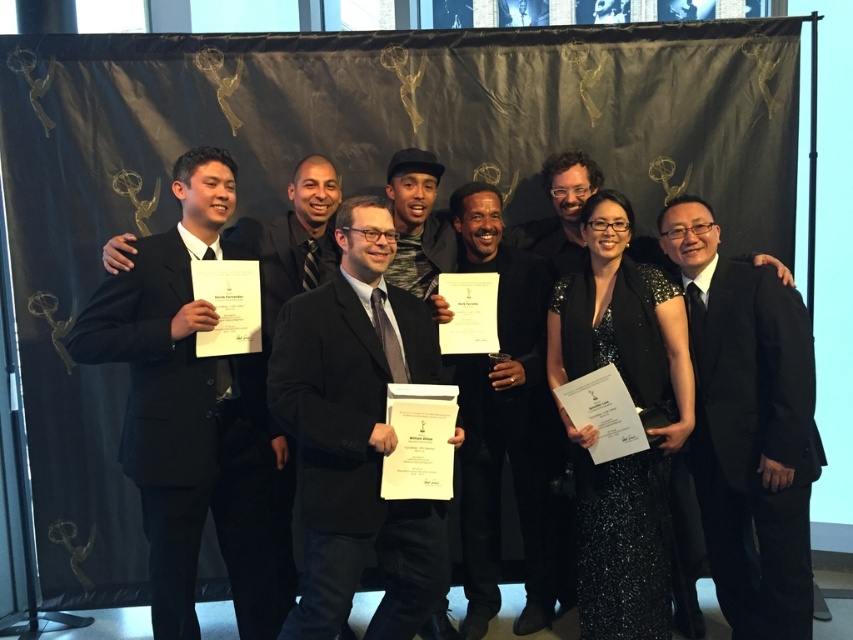
You are a photographer at the Emmy Awards event. You notice the black suit at left and the black satin suit at right in your frame. Which one is closer to the camera?

The black suit at left is closer to the camera because it is in front of the black satin suit at right.

You are a photographer at the Emmy Awards event. You need to arrange the participants so that the black suit at left and the black satin suit at right are placed symmetrically. Given their different widths, which one should be placed closer to the center to maintain symmetry?

The black suit at left is wider than the black satin suit at right. To maintain symmetry, the wider black suit at left should be placed closer to the center so that its greater width balances the narrower black satin suit at right on the opposite side.

You are standing in front of the Emmy Awards backdrop and want to place a small decoration exactly halfway between the two points marked as point (766, 316) and point (480, 490). Will the decoration be closer to the camera than both points?

The decoration placed halfway between point (766, 316) and point (480, 490) will be closer to the camera than point (480, 490) but farther than point (766, 316). Since the question asks if it will be closer than both, the answer is no.